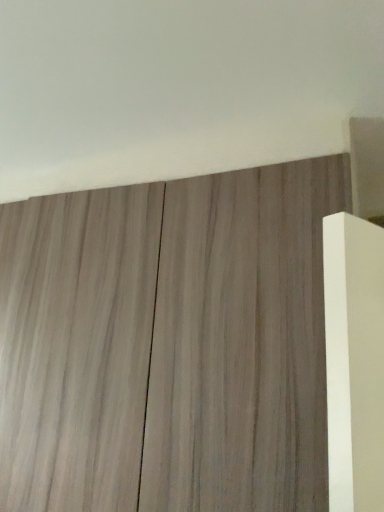
What do you see at coordinates (168, 344) in the screenshot? The width and height of the screenshot is (384, 512). I see `wooden curtain at center` at bounding box center [168, 344].

Find the location of a particular element. This screenshot has height=512, width=384. wooden curtain at center is located at coordinates (168, 344).

Locate an element on the screen. This screenshot has height=512, width=384. wooden curtain at center is located at coordinates (168, 344).